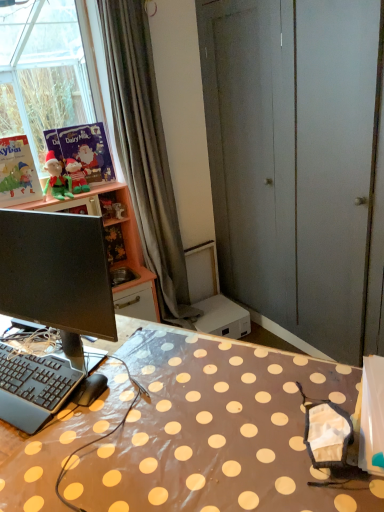
Question: Are matte green plush at upper left, which is the 2th person in left-to-right order, and green plush elf at left, which appears as the first person when viewed from the left, far apart?

Choices:
 (A) yes
 (B) no

Answer: (B)

Question: From a real-world perspective, does matte green plush at upper left, which appears as the 1th person when viewed from the right, stand above green plush elf at left, the 2th person from the right?

Choices:
 (A) no
 (B) yes

Answer: (A)

Question: Is matte green plush at upper left, which appears as the 1th person when viewed from the right, placed right next to green plush elf at left, which appears as the first person when viewed from the left?

Choices:
 (A) no
 (B) yes

Answer: (B)

Question: Can you confirm if matte green plush at upper left, which is the 2th person in left-to-right order, is shorter than green plush elf at left, which appears as the first person when viewed from the left?

Choices:
 (A) yes
 (B) no

Answer: (A)

Question: Would you say matte green plush at upper left, which is the 2th person in left-to-right order, is outside green plush elf at left, which appears as the first person when viewed from the left?

Choices:
 (A) yes
 (B) no

Answer: (A)

Question: From their relative heights in the image, would you say brown polka dot table at center is taller or shorter than black rubberized computer mouse at lower left?

Choices:
 (A) short
 (B) tall

Answer: (B)

Question: From a real-world perspective, is brown polka dot table at center above or below black rubberized computer mouse at lower left?

Choices:
 (A) above
 (B) below

Answer: (B)

Question: From the image's perspective, is brown polka dot table at center located above or below black rubberized computer mouse at lower left?

Choices:
 (A) above
 (B) below

Answer: (B)

Question: Is brown polka dot table at center in front of or behind black rubberized computer mouse at lower left in the image?

Choices:
 (A) behind
 (B) front

Answer: (B)

Question: Would you say matte green plush at upper left, which is the 2th person in left-to-right order, is inside or outside gray fabric curtain at upper left?

Choices:
 (A) outside
 (B) inside

Answer: (A)

Question: Looking at their shapes, would you say matte green plush at upper left, which appears as the 1th person when viewed from the right, is wider or thinner than gray fabric curtain at upper left?

Choices:
 (A) wide
 (B) thin

Answer: (B)

Question: From the image's perspective, relative to gray fabric curtain at upper left, is matte green plush at upper left, which appears as the 1th person when viewed from the right, above or below?

Choices:
 (A) above
 (B) below

Answer: (A)

Question: From a real-world perspective, is matte green plush at upper left, which is the 2th person in left-to-right order, physically located above or below gray fabric curtain at upper left?

Choices:
 (A) below
 (B) above

Answer: (B)

Question: Considering the positions of matte pink cabinet at upper left and gray fabric curtain at upper left in the image, is matte pink cabinet at upper left wider or thinner than gray fabric curtain at upper left?

Choices:
 (A) wide
 (B) thin

Answer: (A)

Question: Based on their sizes in the image, would you say matte pink cabinet at upper left is bigger or smaller than gray fabric curtain at upper left?

Choices:
 (A) small
 (B) big

Answer: (B)